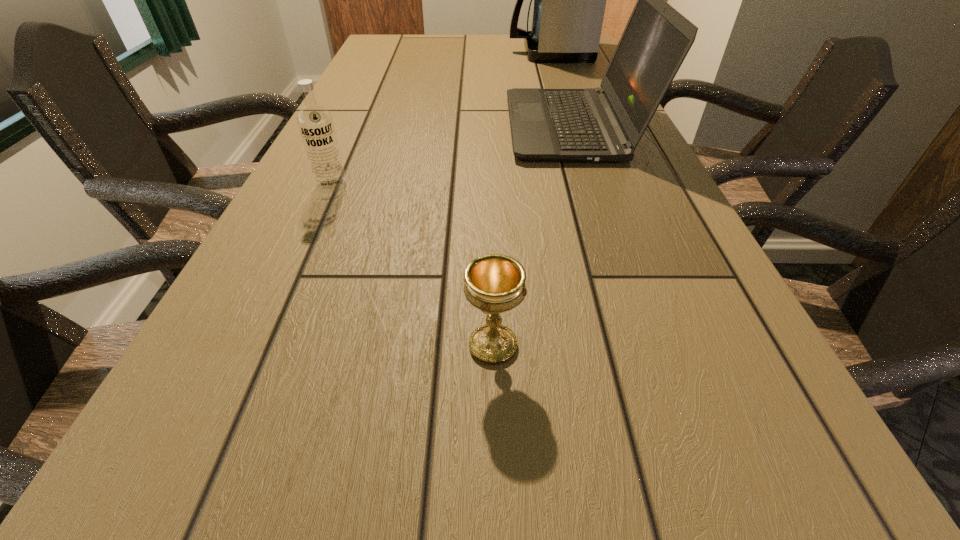
This screenshot has height=540, width=960. Find the location of `vacant space situated on the front panel of the tallest object`. vacant space situated on the front panel of the tallest object is located at coordinates (446, 52).

At what (x,y) coordinates should I click in order to perform the action: click on free space located 0.090m on the screen of the laptop_computer. Please return your answer as a coordinate pair (x, y). The width and height of the screenshot is (960, 540). Looking at the image, I should click on (472, 127).

At what (x,y) coordinates should I click in order to perform the action: click on blank space located 0.310m on the screen of the laptop_computer. Please return your answer as a coordinate pair (x, y). Looking at the image, I should click on (382, 127).

Identify the location of free region located on the screen of the laptop_computer. The width and height of the screenshot is (960, 540). (353, 127).

At what (x,y) coordinates should I click in order to perform the action: click on vacant space located 0.360m on the front label of the second shortest object. Please return your answer as a coordinate pair (x, y). Image resolution: width=960 pixels, height=540 pixels. Looking at the image, I should click on (263, 341).

Locate an element on the screen. The width and height of the screenshot is (960, 540). free region located 0.140m on the left of the shortest object is located at coordinates (363, 346).

At what (x,y) coordinates should I click in order to perform the action: click on object that is at the far edge. Please return your answer as a coordinate pair (x, y). This screenshot has width=960, height=540. Looking at the image, I should click on (569, 0).

Image resolution: width=960 pixels, height=540 pixels. I want to click on object situated at the left edge, so click(315, 122).

I want to click on coffee maker that is positioned at the right edge, so click(x=569, y=0).

Where is `laptop_computer that is at the right edge`? This screenshot has width=960, height=540. laptop_computer that is at the right edge is located at coordinates [x=605, y=124].